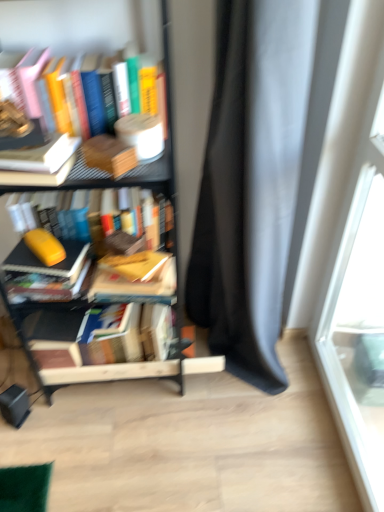
Question: Is point (3, 154) positioned closer to the camera than point (29, 234)?

Choices:
 (A) farther
 (B) closer

Answer: (B)

Question: From a real-world perspective, relative to yellow matte book at left, which ranks as the second paperback book in front-to-back order, is white matte book at upper left, arranged as the fifth book when ordered from the bottom, vertically above or below?

Choices:
 (A) below
 (B) above

Answer: (B)

Question: Which is farther from the matte yellow book at left, the 2th book from the bottom?

Choices:
 (A) yellow matte book at center, the 4th book viewed from the top
 (B) wooden at left, the 2th paperback book in the back-to-front sequence
 (C) hardcover book at center, which is counted as the 1th book, starting from the bottom
 (D) orange matte book at center, which appears as the fourth book when ordered from the bottom
 (E) hardcover book at upper left, positioned as the 1th book in top-to-bottom order

Answer: (E)

Question: Considering the real-world distances, which object is farthest from the hardcover book at upper left, positioned as the 1th book in top-to-bottom order?

Choices:
 (A) transparent glass window at right
 (B) matte gray curtain at right
 (C) metallic black bookcase at left
 (D) orange matte book at center, which appears as the fourth book when ordered from the bottom
 (E) hardcover book at center, which is counted as the 1th book, starting from the bottom

Answer: (A)